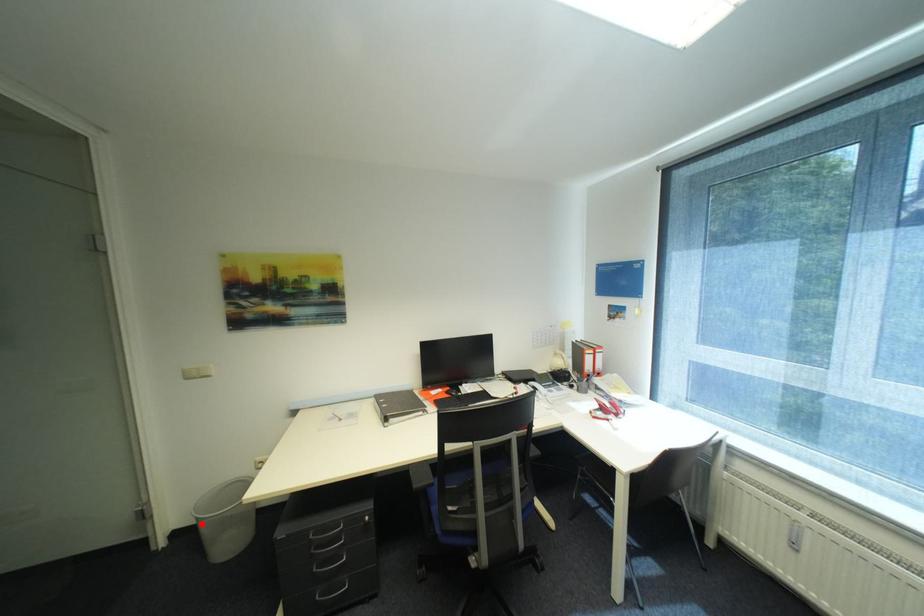
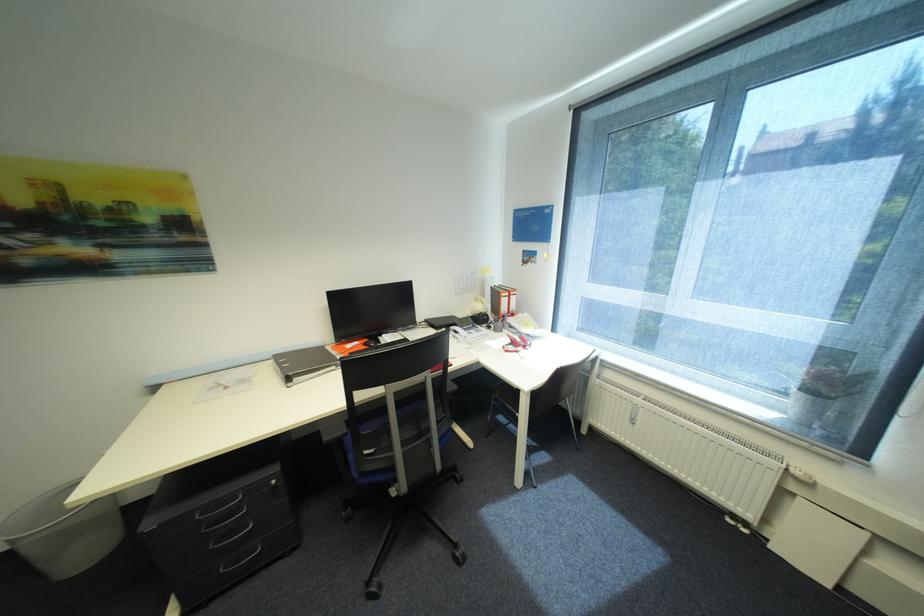
Locate, in the second image, the point that corresponds to the highlighted location in the first image.

(14, 548)